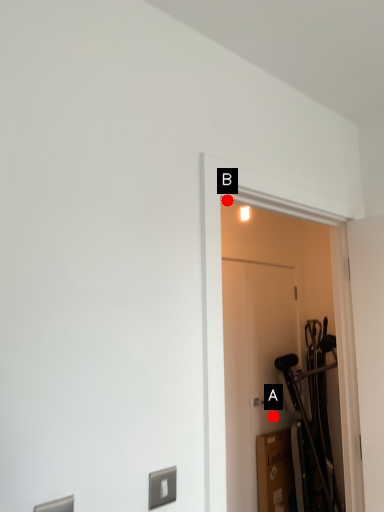
Question: Two points are circled on the image, labeled by A and B beside each circle. Which point is further to the camera?

Choices:
 (A) A is further
 (B) B is further

Answer: (A)